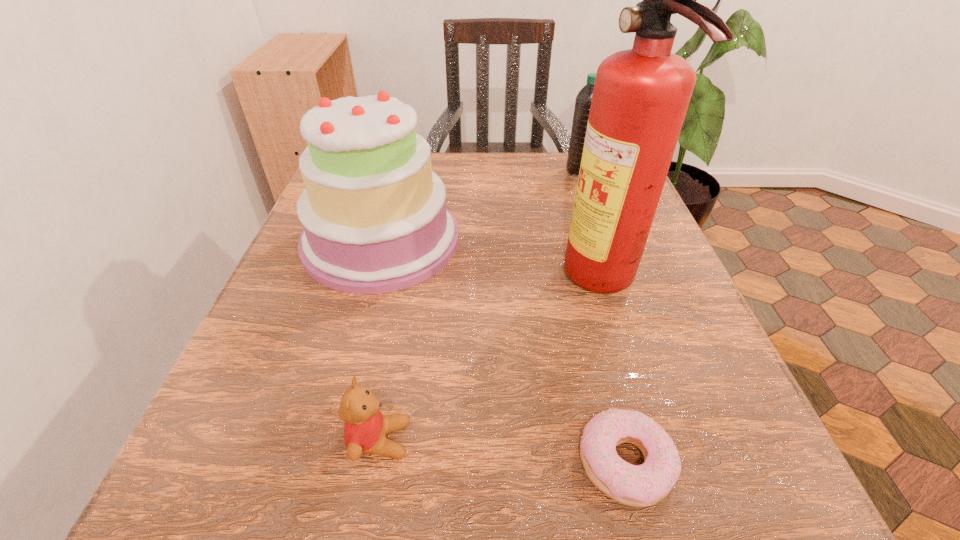
This screenshot has height=540, width=960. I want to click on doughnut at the right edge, so click(x=643, y=485).

This screenshot has height=540, width=960. In order to click on object situated at the far left corner in this screenshot , I will do `click(374, 214)`.

The height and width of the screenshot is (540, 960). Identify the location of object located in the far right corner section of the desktop. (583, 99).

The width and height of the screenshot is (960, 540). In order to click on object that is at the near right corner in this screenshot , I will do `click(643, 485)`.

The width and height of the screenshot is (960, 540). I want to click on blank space at the far edge of the desktop, so click(x=502, y=192).

The image size is (960, 540). I want to click on vacant region at the left edge of the desktop, so click(x=336, y=300).

Image resolution: width=960 pixels, height=540 pixels. In the image, there is a desktop. In order to click on blank space at the right edge in this screenshot , I will do `click(614, 308)`.

In the image, there is a desktop. Where is `vacant region at the far right corner`? The image size is (960, 540). vacant region at the far right corner is located at coordinates (567, 151).

Locate an element on the screen. This screenshot has width=960, height=540. vacant space at the near right corner of the desktop is located at coordinates (730, 516).

Find the location of a particular element. The image size is (960, 540). vacant space in between the doughnut and the tallest object is located at coordinates (614, 373).